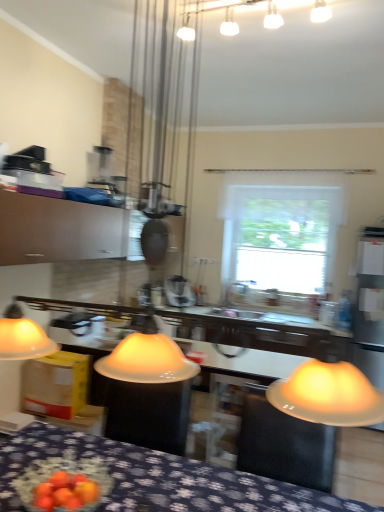
Question: Would you say white glossy sink at center is outside matte white cabinet at upper left?

Choices:
 (A) no
 (B) yes

Answer: (B)

Question: Considering the relative sizes of white glossy sink at center and matte white cabinet at upper left in the image provided, is white glossy sink at center thinner than matte white cabinet at upper left?

Choices:
 (A) yes
 (B) no

Answer: (A)

Question: From the image's perspective, would you say white glossy sink at center is shown under matte white cabinet at upper left?

Choices:
 (A) yes
 (B) no

Answer: (A)

Question: Is there a large distance between white glossy sink at center and matte white cabinet at upper left?

Choices:
 (A) no
 (B) yes

Answer: (B)

Question: Is white glossy sink at center shorter than matte white cabinet at upper left?

Choices:
 (A) no
 (B) yes

Answer: (B)

Question: Is white glossy sink at center further to camera compared to matte white cabinet at upper left?

Choices:
 (A) yes
 (B) no

Answer: (A)

Question: From the image's perspective, is blue fabric tablecloth at lower center under white glossy sink at center?

Choices:
 (A) no
 (B) yes

Answer: (B)

Question: Is the depth of blue fabric tablecloth at lower center less than that of white glossy sink at center?

Choices:
 (A) yes
 (B) no

Answer: (A)

Question: Is blue fabric tablecloth at lower center shorter than white glossy sink at center?

Choices:
 (A) yes
 (B) no

Answer: (B)

Question: Is blue fabric tablecloth at lower center further to the viewer compared to white glossy sink at center?

Choices:
 (A) yes
 (B) no

Answer: (B)

Question: Considering the relative sizes of blue fabric tablecloth at lower center and white glossy sink at center in the image provided, is blue fabric tablecloth at lower center thinner than white glossy sink at center?

Choices:
 (A) no
 (B) yes

Answer: (A)

Question: Is blue fabric tablecloth at lower center taller than white glossy sink at center?

Choices:
 (A) no
 (B) yes

Answer: (B)

Question: Is matte white cabinet at upper left at the right side of white frosted glass light fixture at upper center?

Choices:
 (A) yes
 (B) no

Answer: (B)